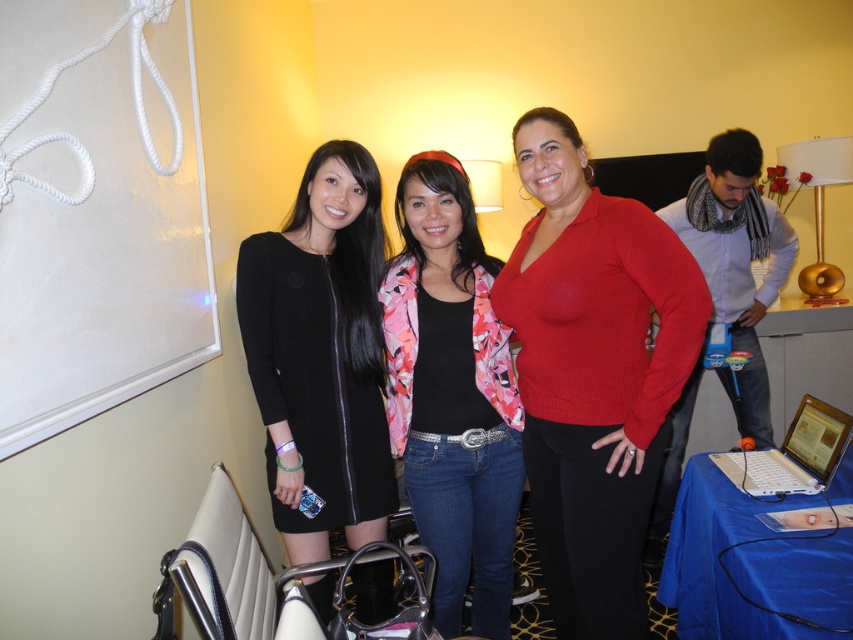
The height and width of the screenshot is (640, 853). What do you see at coordinates (735, 262) in the screenshot?
I see `white glossy laptop at right` at bounding box center [735, 262].

Between white glossy laptop at right and white plastic laptop at lower right, which one is positioned higher?

white glossy laptop at right

Which is behind, point (692, 230) or point (805, 468)?

Positioned behind is point (692, 230).

Locate an element on the screen. white glossy laptop at right is located at coordinates (735, 262).

Is black matte dress at center to the right of floral-patterned jacket at center from the viewer's perspective?

No, black matte dress at center is not to the right of floral-patterned jacket at center.

Does black matte dress at center have a larger size compared to floral-patterned jacket at center?

No.

The image size is (853, 640). What do you see at coordinates (321, 355) in the screenshot? I see `black matte dress at center` at bounding box center [321, 355].

Identify the location of black matte dress at center. (321, 355).

Does knit red sweater at center appear over white glossy laptop at right?

Incorrect, knit red sweater at center is not positioned above white glossy laptop at right.

Can you confirm if knit red sweater at center is positioned to the left of white glossy laptop at right?

Indeed, knit red sweater at center is positioned on the left side of white glossy laptop at right.

Who is more forward, (531,166) or (734,264)?

Point (531,166) is more forward.

Image resolution: width=853 pixels, height=640 pixels. I want to click on knit red sweater at center, so click(593, 372).